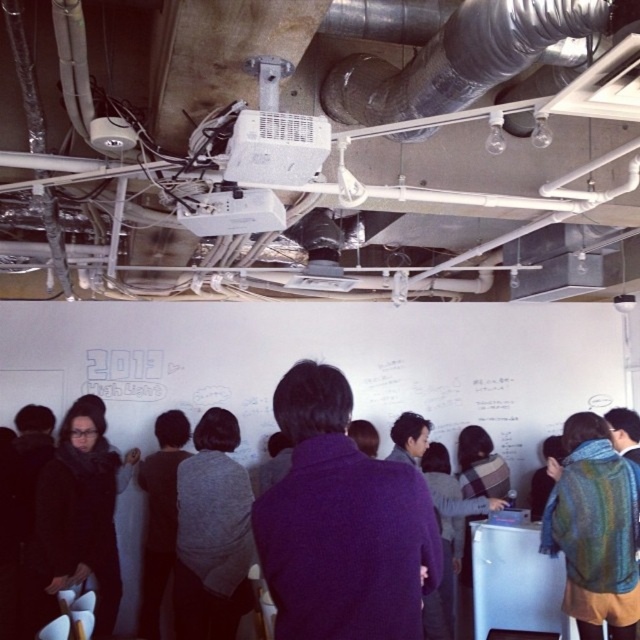
Question: Which point appears farthest from the camera in this image?

Choices:
 (A) (394, 588)
 (B) (132, 444)
 (C) (109, 573)

Answer: (B)

Question: Can you confirm if metallic flexible duct at upper center is positioned to the left of matte black scarf at center?

Choices:
 (A) no
 (B) yes

Answer: (A)

Question: Can you confirm if striped wool scarf at center is positioned to the left of matte black scarf at center?

Choices:
 (A) no
 (B) yes

Answer: (A)

Question: From the image, what is the correct spatial relationship of purple wool sweater at center in relation to gray wool sweater at center?

Choices:
 (A) left
 (B) right

Answer: (B)

Question: Which object is the farthest from the gray wool sweater at center?

Choices:
 (A) metallic flexible duct at upper center
 (B) purple wool sweater at center
 (C) striped wool scarf at center

Answer: (A)

Question: Based on their relative distances, which object is farther from the striped wool scarf at center?

Choices:
 (A) white matte whiteboard at center
 (B) gray wool sweater at center
 (C) purple wool sweater at center

Answer: (C)